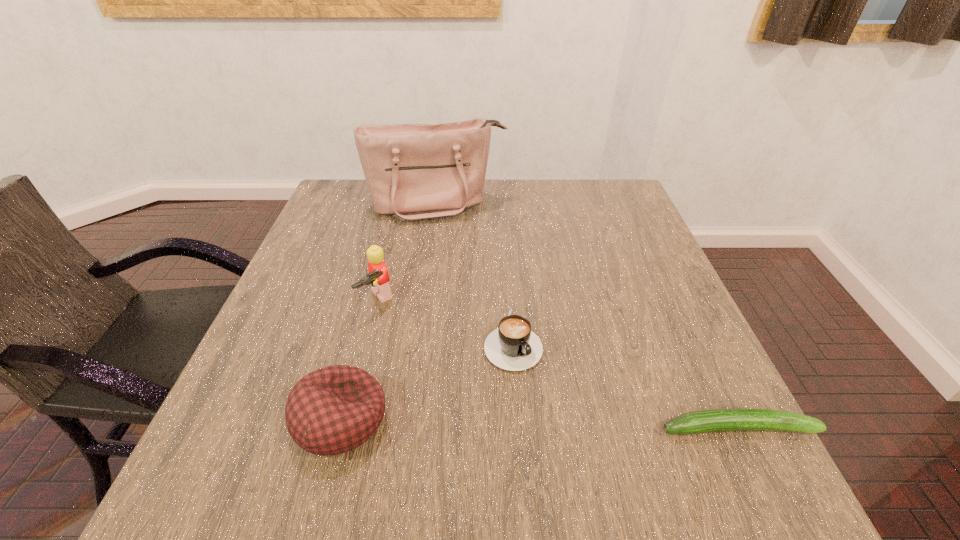
You are a GUI agent. You are given a task and a screenshot of the screen. Output one action in this format:
    pyautogui.click(x=<x>, y=<y>)
    Task: Click on the empty space between the cappuccino and the rightmost object
    The height and width of the screenshot is (540, 960).
    Given the screenshot: What is the action you would take?
    pyautogui.click(x=625, y=383)

The width and height of the screenshot is (960, 540). Find the location of `free space between the second tallest object and the cappuccino`. free space between the second tallest object and the cappuccino is located at coordinates (445, 319).

This screenshot has height=540, width=960. What are the coordinates of `empty space between the beanbag and the second shortest object` in the screenshot? It's located at (426, 379).

I want to click on free spot between the beanbag and the tallest object, so click(390, 312).

You are a GUI agent. You are given a task and a screenshot of the screen. Output one action in this format:
    pyautogui.click(x=<x>, y=<y>)
    Task: Click on the vacant space that is in between the farthest object and the beanbag
    
    Given the screenshot: What is the action you would take?
    pyautogui.click(x=390, y=312)

You are a GUI agent. You are given a task and a screenshot of the screen. Output one action in this format:
    pyautogui.click(x=<x>, y=<y>)
    Task: Click on the free space between the cappuccino and the tallest object
    
    Given the screenshot: What is the action you would take?
    pyautogui.click(x=475, y=272)

Find the location of a particular element. The image size is (960, 540). empty location between the Lego and the farthest object is located at coordinates (408, 253).

At what (x,y) coordinates should I click in order to perform the action: click on free area in between the cappuccino and the third tallest object. Please return your answer as a coordinate pair (x, y). Looking at the image, I should click on (426, 379).

You are a GUI agent. You are given a task and a screenshot of the screen. Output one action in this format:
    pyautogui.click(x=<x>, y=<y>)
    Task: Click on the vacant area between the beanbag and the Lego
    
    Given the screenshot: What is the action you would take?
    pyautogui.click(x=360, y=360)

Locate an element on the screen. This screenshot has height=540, width=960. vacant area between the tallest object and the fourth shortest object is located at coordinates (408, 253).